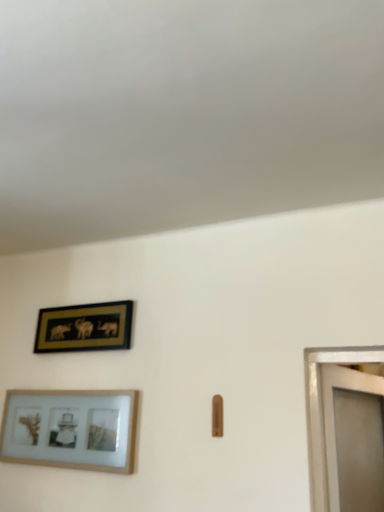
Find the location of a particular element. wooden picture frame at lower left, marked as the 1th picture frame in a bottom-to-top arrangement is located at coordinates (70, 429).

What is the approximate height of wooden picture frame at lower left, marked as the 1th picture frame in a bottom-to-top arrangement?

It is 12.96 inches.

The image size is (384, 512). Describe the element at coordinates (70, 429) in the screenshot. I see `wooden picture frame at lower left, marked as the 1th picture frame in a bottom-to-top arrangement` at that location.

Locate an element on the screen. The image size is (384, 512). gold-framed artwork at upper left, the second picture frame positioned from the bottom is located at coordinates (x=85, y=327).

What do you see at coordinates (85, 327) in the screenshot? The image size is (384, 512). I see `gold-framed artwork at upper left, the second picture frame positioned from the bottom` at bounding box center [85, 327].

Where is `wooden picture frame at lower left, which is counted as the 2th picture frame, starting from the top`? The image size is (384, 512). wooden picture frame at lower left, which is counted as the 2th picture frame, starting from the top is located at coordinates (70, 429).

Which is more to the right, gold-framed artwork at upper left, which is the first picture frame from top to bottom, or wooden picture frame at lower left, marked as the 1th picture frame in a bottom-to-top arrangement?

gold-framed artwork at upper left, which is the first picture frame from top to bottom, is more to the right.

Is gold-framed artwork at upper left, which is the first picture frame from top to bottom, positioned behind wooden picture frame at lower left, marked as the 1th picture frame in a bottom-to-top arrangement?

Yes, it is.

Is point (104, 334) closer to viewer compared to point (132, 468)?

No, it is behind (132, 468).

From the image's perspective, which is below, gold-framed artwork at upper left, which is the first picture frame from top to bottom, or wooden picture frame at lower left, marked as the 1th picture frame in a bottom-to-top arrangement?

From the image's view, wooden picture frame at lower left, marked as the 1th picture frame in a bottom-to-top arrangement, is below.

Consider the image. From a real-world perspective, is gold-framed artwork at upper left, which is the first picture frame from top to bottom, on top of wooden picture frame at lower left, marked as the 1th picture frame in a bottom-to-top arrangement?

Yes, from a real-world perspective, gold-framed artwork at upper left, which is the first picture frame from top to bottom, is above wooden picture frame at lower left, marked as the 1th picture frame in a bottom-to-top arrangement.

Which object is wider, gold-framed artwork at upper left, which is the first picture frame from top to bottom, or wooden picture frame at lower left, which is counted as the 2th picture frame, starting from the top?

→ With larger width is wooden picture frame at lower left, which is counted as the 2th picture frame, starting from the top.

Is gold-framed artwork at upper left, which is the first picture frame from top to bottom, taller or shorter than wooden picture frame at lower left, which is counted as the 2th picture frame, starting from the top?

gold-framed artwork at upper left, which is the first picture frame from top to bottom, is shorter than wooden picture frame at lower left, which is counted as the 2th picture frame, starting from the top.

Does gold-framed artwork at upper left, which is the first picture frame from top to bottom, have a larger size compared to wooden picture frame at lower left, marked as the 1th picture frame in a bottom-to-top arrangement?

No, gold-framed artwork at upper left, which is the first picture frame from top to bottom, is not bigger than wooden picture frame at lower left, marked as the 1th picture frame in a bottom-to-top arrangement.

Is gold-framed artwork at upper left, the second picture frame positioned from the bottom, outside of wooden picture frame at lower left, marked as the 1th picture frame in a bottom-to-top arrangement?

Yes, gold-framed artwork at upper left, the second picture frame positioned from the bottom, is not within wooden picture frame at lower left, marked as the 1th picture frame in a bottom-to-top arrangement.

Is gold-framed artwork at upper left, the second picture frame positioned from the bottom, next to wooden picture frame at lower left, which is counted as the 2th picture frame, starting from the top?

gold-framed artwork at upper left, the second picture frame positioned from the bottom, is not next to wooden picture frame at lower left, which is counted as the 2th picture frame, starting from the top, and they're not touching.

Is gold-framed artwork at upper left, which is the first picture frame from top to bottom, facing away from wooden picture frame at lower left, which is counted as the 2th picture frame, starting from the top?

That's not correct — gold-framed artwork at upper left, which is the first picture frame from top to bottom, is not looking away from wooden picture frame at lower left, which is counted as the 2th picture frame, starting from the top.

Based on the photo, how different are the orientations of gold-framed artwork at upper left, the second picture frame positioned from the bottom, and wooden picture frame at lower left, marked as the 1th picture frame in a bottom-to-top arrangement, in degrees?

The angular difference between gold-framed artwork at upper left, the second picture frame positioned from the bottom, and wooden picture frame at lower left, marked as the 1th picture frame in a bottom-to-top arrangement, is 0.000227 degrees.

Measure the distance from gold-framed artwork at upper left, the second picture frame positioned from the bottom, to wooden picture frame at lower left, marked as the 1th picture frame in a bottom-to-top arrangement.

The distance of gold-framed artwork at upper left, the second picture frame positioned from the bottom, from wooden picture frame at lower left, marked as the 1th picture frame in a bottom-to-top arrangement, is 12.69 inches.

The width and height of the screenshot is (384, 512). Find the location of `picture frame on the right of the wooden picture frame at lower left, marked as the 1th picture frame in a bottom-to-top arrangement`. picture frame on the right of the wooden picture frame at lower left, marked as the 1th picture frame in a bottom-to-top arrangement is located at coordinates (85, 327).

Which is more to the left, wooden picture frame at lower left, marked as the 1th picture frame in a bottom-to-top arrangement, or gold-framed artwork at upper left, the second picture frame positioned from the bottom?

Positioned to the left is wooden picture frame at lower left, marked as the 1th picture frame in a bottom-to-top arrangement.

Who is more distant, wooden picture frame at lower left, marked as the 1th picture frame in a bottom-to-top arrangement, or gold-framed artwork at upper left, which is the first picture frame from top to bottom?

gold-framed artwork at upper left, which is the first picture frame from top to bottom, is further from the camera.

Does point (63, 430) come farther from viewer compared to point (42, 324)?

No, it is in front of (42, 324).

From the image's perspective, is wooden picture frame at lower left, marked as the 1th picture frame in a bottom-to-top arrangement, under gold-framed artwork at upper left, which is the first picture frame from top to bottom?

Yes, from the image's perspective, wooden picture frame at lower left, marked as the 1th picture frame in a bottom-to-top arrangement, is beneath gold-framed artwork at upper left, which is the first picture frame from top to bottom.

From a real-world perspective, is wooden picture frame at lower left, marked as the 1th picture frame in a bottom-to-top arrangement, located higher than gold-framed artwork at upper left, the second picture frame positioned from the bottom?

No, from a real-world perspective, wooden picture frame at lower left, marked as the 1th picture frame in a bottom-to-top arrangement, is not above gold-framed artwork at upper left, the second picture frame positioned from the bottom.

Which object is wider, wooden picture frame at lower left, marked as the 1th picture frame in a bottom-to-top arrangement, or gold-framed artwork at upper left, which is the first picture frame from top to bottom?

With larger width is wooden picture frame at lower left, marked as the 1th picture frame in a bottom-to-top arrangement.

Who is shorter, wooden picture frame at lower left, which is counted as the 2th picture frame, starting from the top, or gold-framed artwork at upper left, which is the first picture frame from top to bottom?

With less height is gold-framed artwork at upper left, which is the first picture frame from top to bottom.

Which of these two, wooden picture frame at lower left, marked as the 1th picture frame in a bottom-to-top arrangement, or gold-framed artwork at upper left, the second picture frame positioned from the bottom, is smaller?

With smaller size is gold-framed artwork at upper left, the second picture frame positioned from the bottom.

Does wooden picture frame at lower left, marked as the 1th picture frame in a bottom-to-top arrangement, contain gold-framed artwork at upper left, which is the first picture frame from top to bottom?

No, wooden picture frame at lower left, marked as the 1th picture frame in a bottom-to-top arrangement, does not contain gold-framed artwork at upper left, which is the first picture frame from top to bottom.

Would you consider wooden picture frame at lower left, which is counted as the 2th picture frame, starting from the top, to be distant from gold-framed artwork at upper left, which is the first picture frame from top to bottom?

That's not correct — wooden picture frame at lower left, which is counted as the 2th picture frame, starting from the top, is a little close to gold-framed artwork at upper left, which is the first picture frame from top to bottom.

Is wooden picture frame at lower left, marked as the 1th picture frame in a bottom-to-top arrangement, looking in the opposite direction of gold-framed artwork at upper left, which is the first picture frame from top to bottom?

No, wooden picture frame at lower left, marked as the 1th picture frame in a bottom-to-top arrangement,'s orientation is not away from gold-framed artwork at upper left, which is the first picture frame from top to bottom.

Image resolution: width=384 pixels, height=512 pixels. I want to click on picture frame above the wooden picture frame at lower left, marked as the 1th picture frame in a bottom-to-top arrangement (from the image's perspective), so click(x=85, y=327).

Where is `picture frame on the right side of wooden picture frame at lower left, marked as the 1th picture frame in a bottom-to-top arrangement`? The height and width of the screenshot is (512, 384). picture frame on the right side of wooden picture frame at lower left, marked as the 1th picture frame in a bottom-to-top arrangement is located at coordinates (85, 327).

At what (x,y) coordinates should I click in order to perform the action: click on picture frame below the gold-framed artwork at upper left, which is the first picture frame from top to bottom (from a real-world perspective). Please return your answer as a coordinate pair (x, y). The height and width of the screenshot is (512, 384). Looking at the image, I should click on (70, 429).